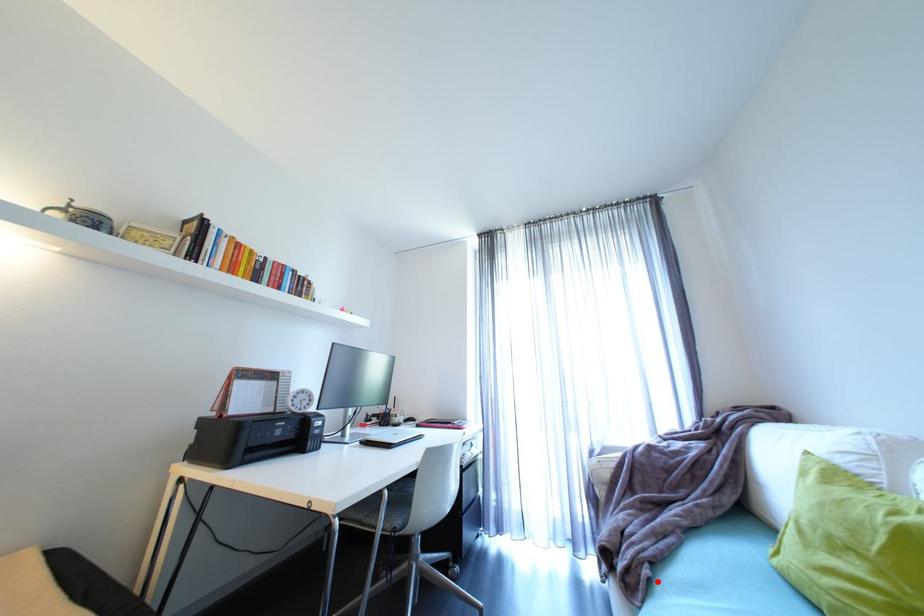
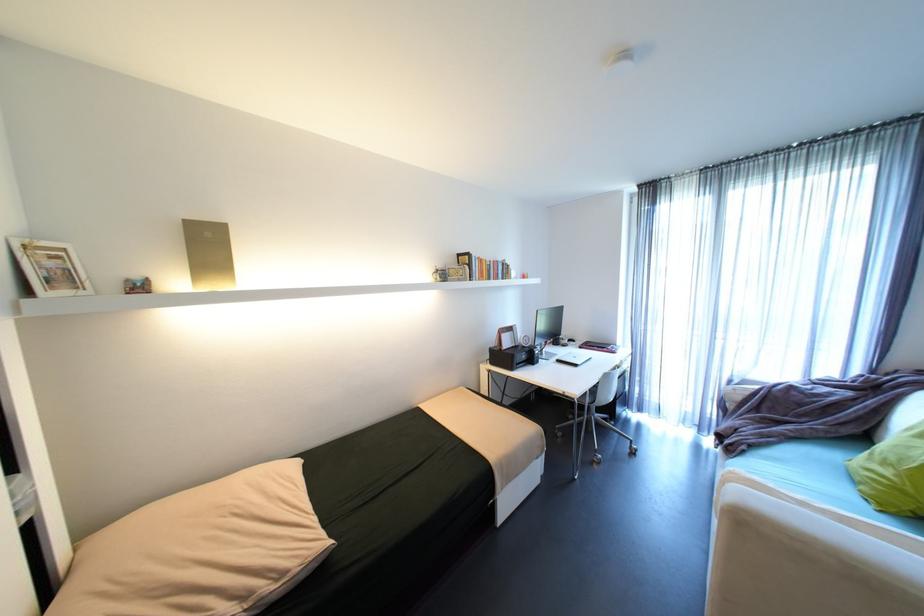
Find the pixel in the second image that matches the highlighted location in the first image.

(751, 451)